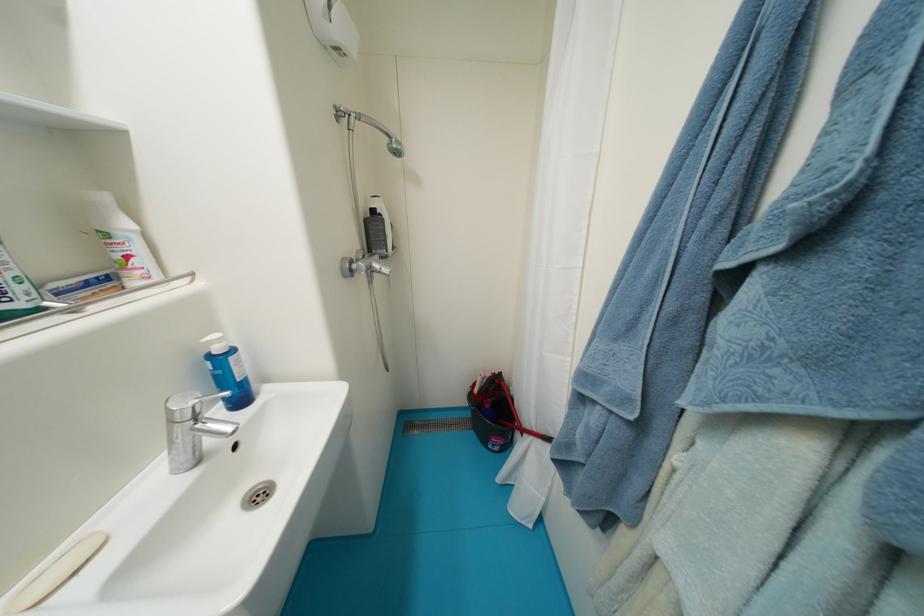
This screenshot has height=616, width=924. What do you see at coordinates (228, 358) in the screenshot?
I see `the blue dispenser pump` at bounding box center [228, 358].